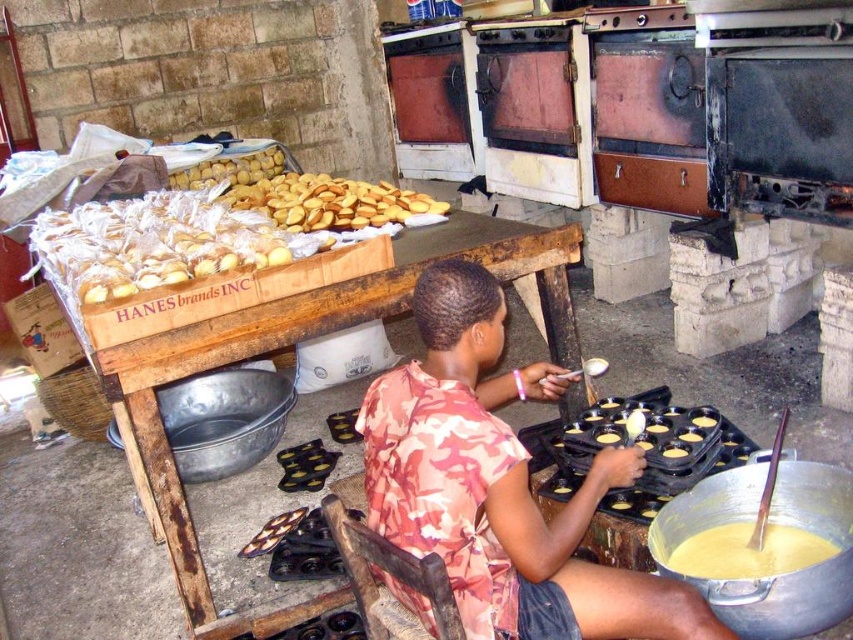
Which is in front, point (492, 301) or point (247, 321)?

Point (492, 301) is in front.

Locate an element on the screen. The image size is (853, 640). pink camouflage shirt at center is located at coordinates (498, 484).

Can you confirm if white wrapped cookies at upper left is positioned to the right of yellow matte cookies at upper left?

No, white wrapped cookies at upper left is not to the right of yellow matte cookies at upper left.

This screenshot has height=640, width=853. Find the location of `white wrapped cookies at upper left`. white wrapped cookies at upper left is located at coordinates tap(151, 243).

At what (x,y) coordinates should I click in order to perform the action: click on white wrapped cookies at upper left. Please return your answer as a coordinate pair (x, y). Image resolution: width=853 pixels, height=640 pixels. Looking at the image, I should click on (151, 243).

Is point (514, 564) positioned after point (602, 444)?

No, (514, 564) is closer to viewer.

Can you confirm if pink camouflage shirt at center is taller than yellow matte cupcake at center?

Correct, pink camouflage shirt at center is much taller as yellow matte cupcake at center.

Describe the element at coordinates (498, 484) in the screenshot. I see `pink camouflage shirt at center` at that location.

Where is `pink camouflage shirt at center`? pink camouflage shirt at center is located at coordinates (498, 484).